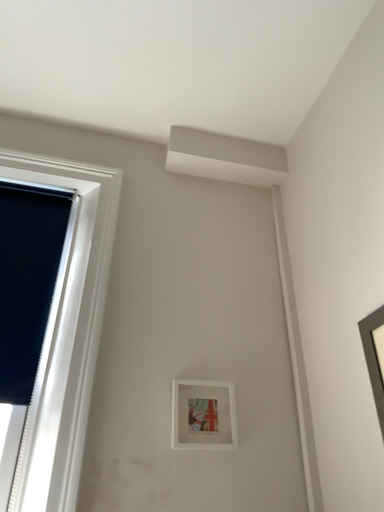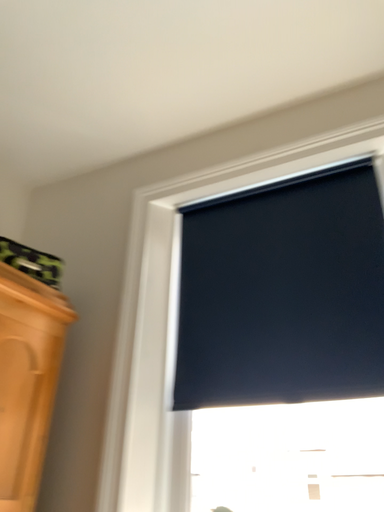
Question: How did the camera likely rotate when shooting the video?

Choices:
 (A) rotated right
 (B) rotated left

Answer: (B)